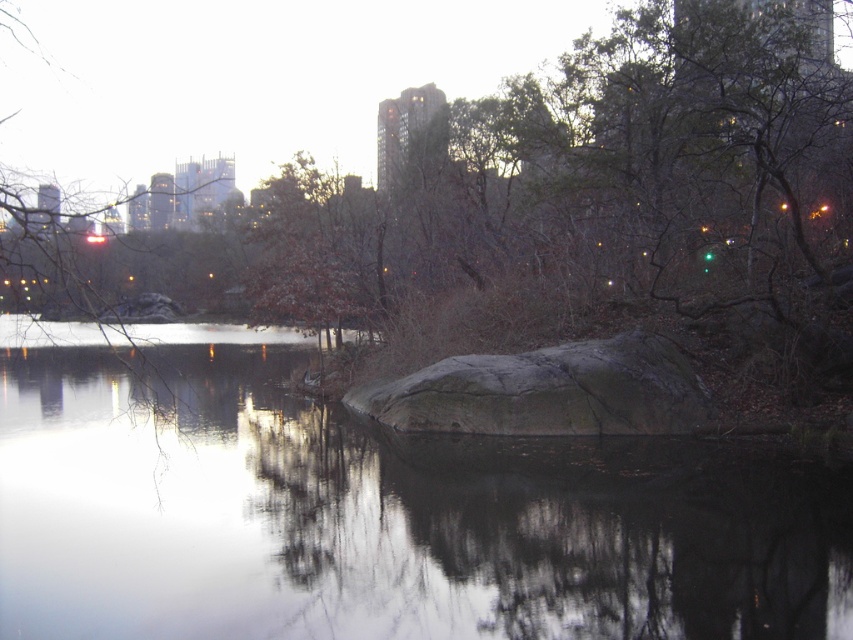
Question: Does smooth dark water at center appear over gray rough rock at center?

Choices:
 (A) no
 (B) yes

Answer: (B)

Question: Which point is farther to the camera?

Choices:
 (A) (413, 381)
 (B) (155, 496)

Answer: (A)

Question: Among these objects, which one is nearest to the camera?

Choices:
 (A) gray rough rock at center
 (B) smooth dark water at center

Answer: (B)

Question: Is smooth dark water at center further to camera compared to gray rough rock at center?

Choices:
 (A) yes
 (B) no

Answer: (B)

Question: Where is smooth dark water at center located in relation to gray rough rock at center in the image?

Choices:
 (A) below
 (B) above

Answer: (B)

Question: Among these objects, which one is nearest to the camera?

Choices:
 (A) smooth dark water at center
 (B) gray rough rock at center

Answer: (A)